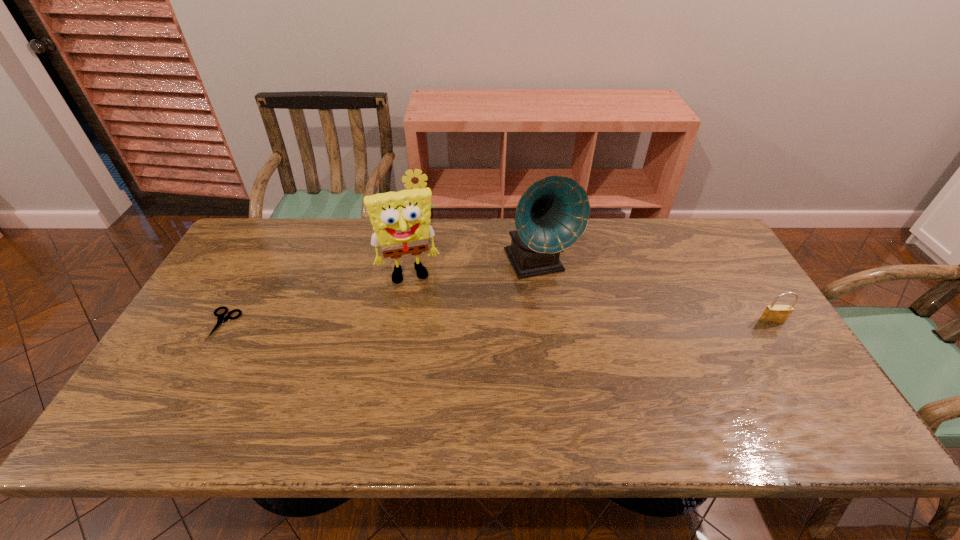
Identify the location of vacant space located on the front-facing side of the rightmost object. (812, 384).

At what (x,y) coordinates should I click in order to perform the action: click on vacant space located from the horn of the phonograph_record. Please return your answer as a coordinate pair (x, y). Image resolution: width=960 pixels, height=540 pixels. Looking at the image, I should click on (570, 322).

Where is `free location located 0.230m from the horn of the phonograph_record`? The height and width of the screenshot is (540, 960). free location located 0.230m from the horn of the phonograph_record is located at coordinates (586, 351).

I want to click on vacant region located from the horn of the phonograph_record, so click(585, 348).

This screenshot has width=960, height=540. I want to click on free spot located 0.080m on the front-facing side of the farthest object, so pyautogui.click(x=421, y=247).

Locate an element on the screen. The width and height of the screenshot is (960, 540). vacant space located on the front-facing side of the farthest object is located at coordinates (421, 292).

The width and height of the screenshot is (960, 540). What are the coordinates of `vacant space positioned on the front-facing side of the farthest object` in the screenshot? It's located at (421, 256).

Identify the location of vacant space situated 0.310m on the face of the second tallest object. (433, 372).

In order to click on vacant space situated on the face of the second tallest object in this screenshot , I will do `click(429, 356)`.

Identify the location of vacant space situated 0.070m on the face of the second tallest object. (418, 303).